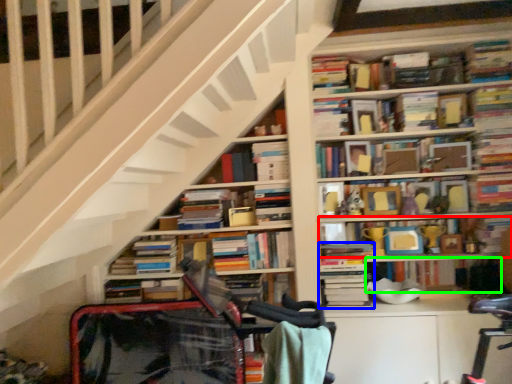
Question: Which is nearer to the book (highlighted by a red box)? book (highlighted by a blue box) or book (highlighted by a green box).

Choices:
 (A) book
 (B) book

Answer: (B)